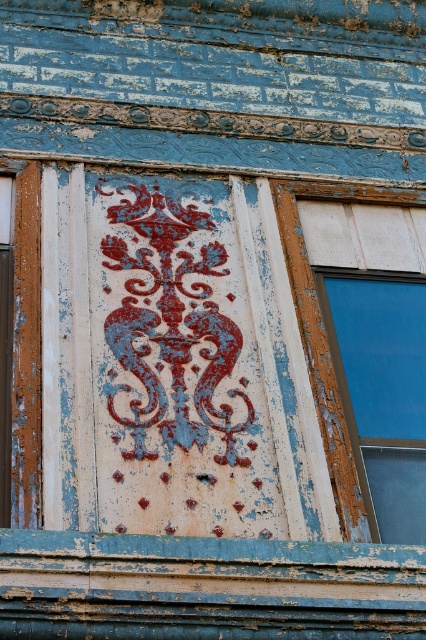
Question: Which of the following is the closest to the observer?

Choices:
 (A) blue glass window at right
 (B) rusty metal octopus at center

Answer: (A)

Question: From the image, what is the correct spatial relationship of rusty metal octopus at center in relation to blue glass window at right?

Choices:
 (A) left
 (B) right

Answer: (A)

Question: Is rusty metal octopus at center further to camera compared to blue glass window at right?

Choices:
 (A) yes
 (B) no

Answer: (A)

Question: Does rusty metal octopus at center lie behind blue glass window at right?

Choices:
 (A) no
 (B) yes

Answer: (B)